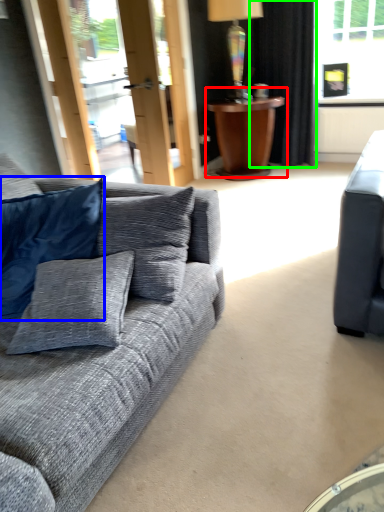
Question: Based on their relative distances, which object is nearer to table (highlighted by a red box)? Choose from pillow (highlighted by a blue box) and curtain (highlighted by a green box).

Choices:
 (A) pillow
 (B) curtain

Answer: (B)